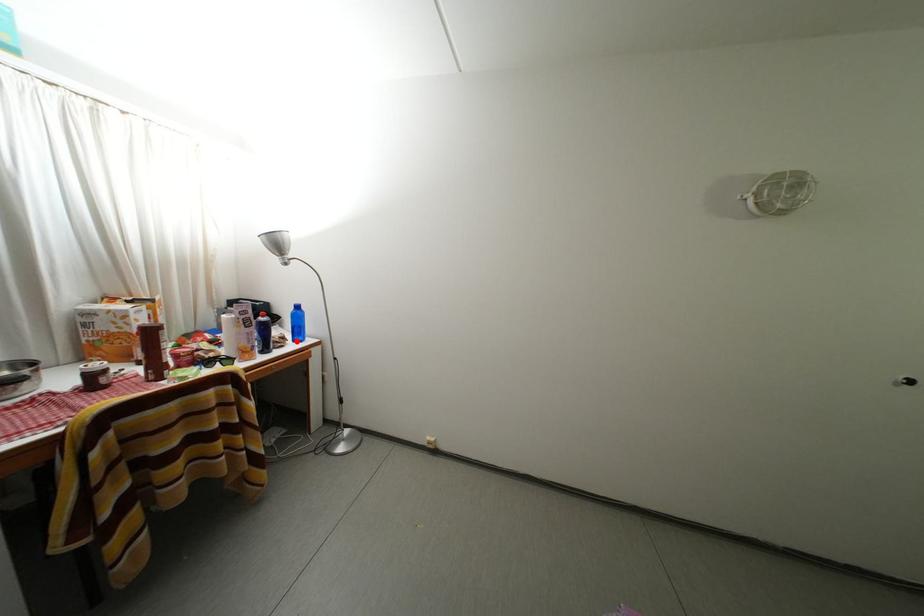
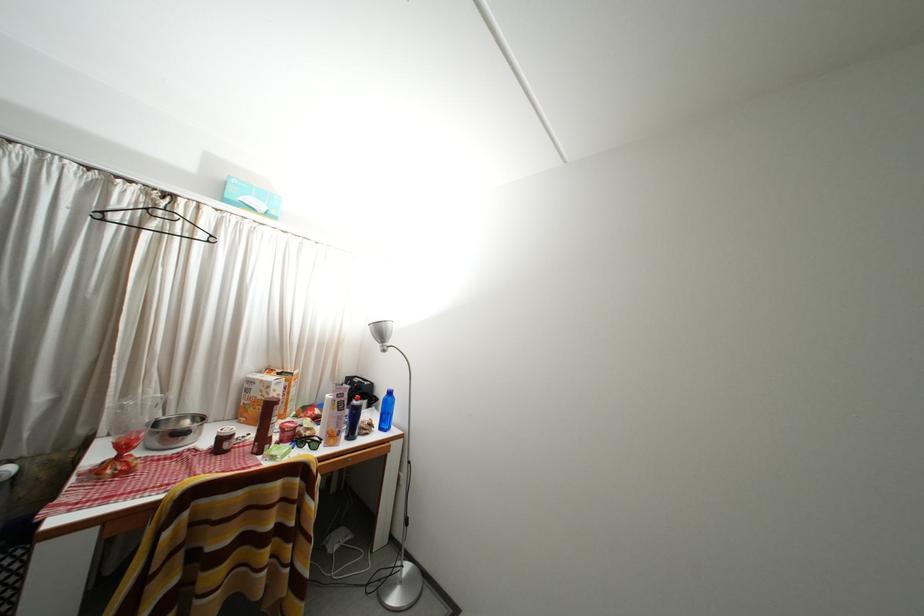
Question: I am providing you with two images of the same scene from different viewpoints. Image1 has a red point marked. In image2, the corresponding 3D location appears at what relative position? Reply with the corresponding letter.

Choices:
 (A) Closer
 (B) Farther

Answer: (B)